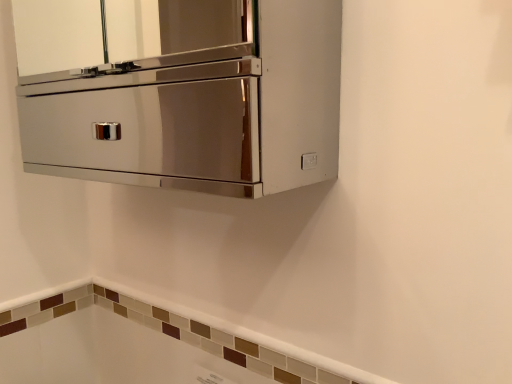
Question: Should I look upward or downward to see polished stainless steel cabinet at upper center?

Choices:
 (A) down
 (B) up

Answer: (B)